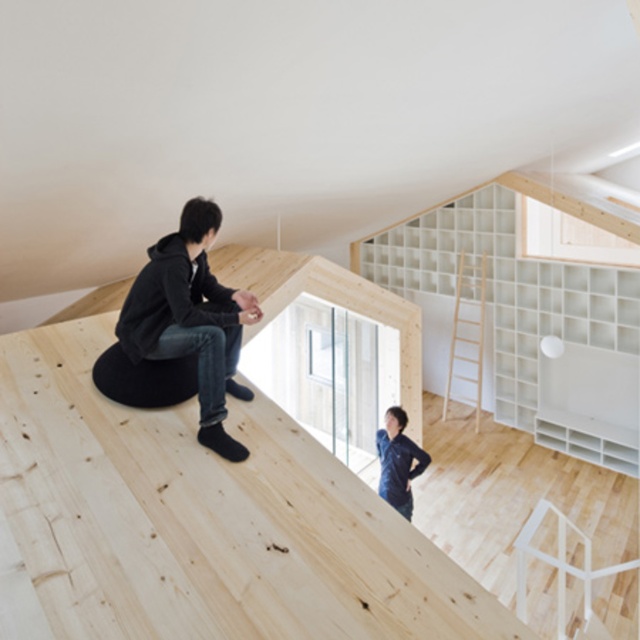
Question: Which object is farther from the camera taking this photo?

Choices:
 (A) black matte bean bag at upper left
 (B) dark blue fabric at upper center

Answer: (B)

Question: Can you confirm if black matte bean bag at upper left is positioned below dark blue fabric at upper center?

Choices:
 (A) yes
 (B) no

Answer: (B)

Question: Which point is farther to the camera?

Choices:
 (A) dark blue fabric at upper center
 (B) black matte bean bag at upper left

Answer: (A)

Question: Does black matte bean bag at upper left have a larger size compared to dark blue fabric at upper center?

Choices:
 (A) no
 (B) yes

Answer: (B)

Question: Can you confirm if black matte bean bag at upper left is wider than dark blue fabric at upper center?

Choices:
 (A) yes
 (B) no

Answer: (A)